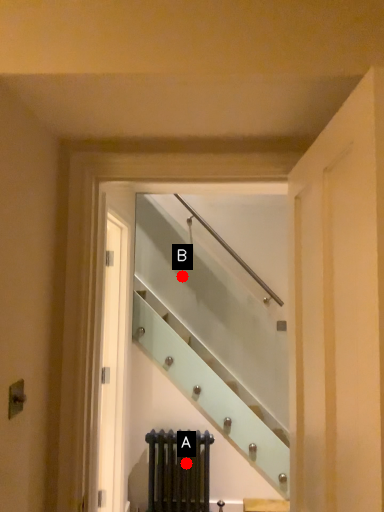
Question: Two points are circled on the image, labeled by A and B beside each circle. Which point appears farthest from the camera in this image?

Choices:
 (A) A is further
 (B) B is further

Answer: (B)